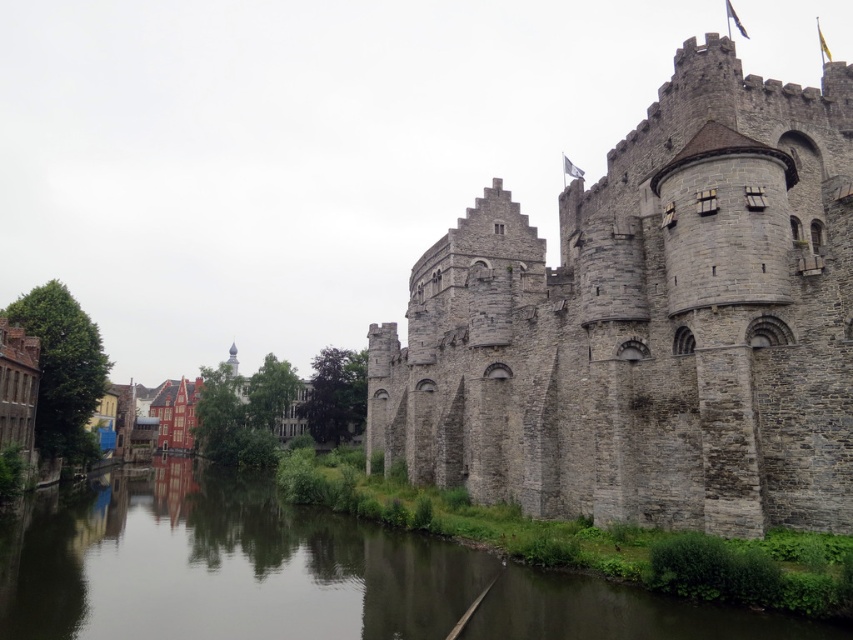
Question: Which object is closer to the camera taking this photo?

Choices:
 (A) gray stone castle at center
 (B) smooth concrete water at center

Answer: (B)

Question: Observing the image, what is the correct spatial positioning of gray stone castle at center in reference to smooth concrete water at center?

Choices:
 (A) below
 (B) above

Answer: (B)

Question: Does gray stone castle at center have a greater width compared to smooth concrete water at center?

Choices:
 (A) no
 (B) yes

Answer: (A)

Question: Is gray stone castle at center below smooth concrete water at center?

Choices:
 (A) no
 (B) yes

Answer: (A)